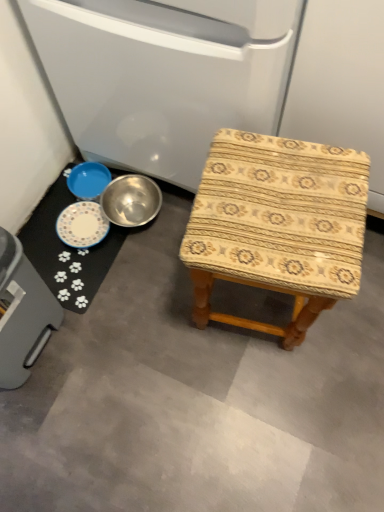
I want to click on free point above wooden-patterned stool at center (from a real-world perspective), so click(x=281, y=202).